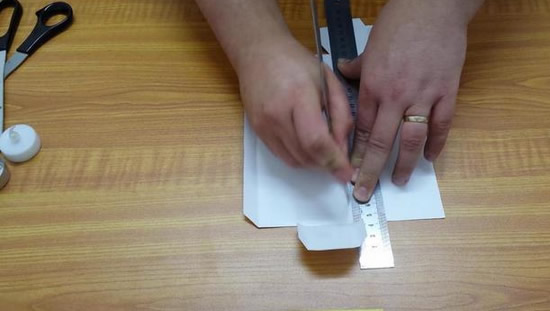
This screenshot has height=311, width=550. I want to click on candle, so click(20, 139).